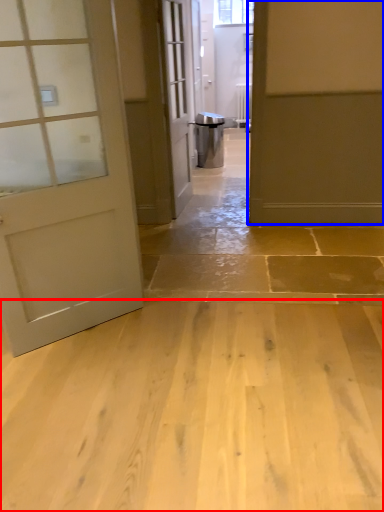
Question: Which object appears closest to the camera in this image, concrete (highlighted by a red box) or door (highlighted by a blue box)?

Choices:
 (A) concrete
 (B) door

Answer: (A)